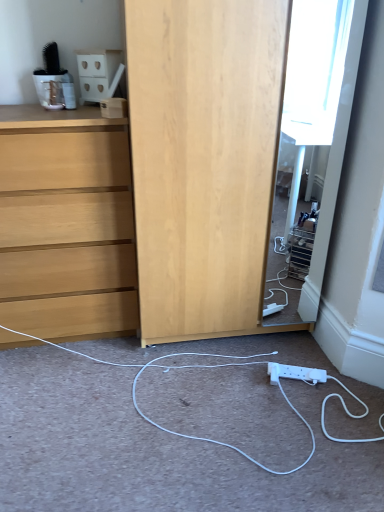
Locate an element on the screen. The height and width of the screenshot is (512, 384). white plastic power strip at lower center is located at coordinates (295, 373).

What are the coordinates of `white matte cabinet at upper left` in the screenshot? It's located at (99, 73).

I want to click on white plastic power strip at lower center, so click(295, 373).

Which object is more forward, light wood chest of drawers at left or white plastic power strip at lower center?

light wood chest of drawers at left.

From their relative heights in the image, would you say light wood chest of drawers at left is taller or shorter than white plastic power strip at lower center?

In the image, light wood chest of drawers at left appears to be taller than white plastic power strip at lower center.

From the image's perspective, is light wood chest of drawers at left located above white plastic power strip at lower center?

Yes.

Could you measure the distance between light wood chest of drawers at left and white plastic power strip at lower center?

light wood chest of drawers at left and white plastic power strip at lower center are 38.74 inches apart from each other.

From a real-world perspective, is white matte cabinet at upper left above or below white plastic power strip at lower center?

white matte cabinet at upper left is situated higher than white plastic power strip at lower center in the real world.

Which is in front, point (98, 82) or point (276, 370)?

The point (98, 82) is in front.

Consider the image. Considering the relative positions of white matte cabinet at upper left and white plastic power strip at lower center in the image provided, is white matte cabinet at upper left to the right of white plastic power strip at lower center from the viewer's perspective?

In fact, white matte cabinet at upper left is to the left of white plastic power strip at lower center.

Is white matte cabinet at upper left positioned with its back to white plastic power strip at lower center?

white matte cabinet at upper left is not turned away from white plastic power strip at lower center.

Considering the relative sizes of white plastic power strip at lower center and white matte cabinet at upper left in the image provided, is white plastic power strip at lower center wider than white matte cabinet at upper left?

Incorrect, the width of white plastic power strip at lower center does not surpass that of white matte cabinet at upper left.

How different are the orientations of white plastic power strip at lower center and white matte cabinet at upper left in degrees?

24.4 degrees.

From the image's perspective, is white plastic power strip at lower center on top of white matte cabinet at upper left?

Actually, white plastic power strip at lower center appears below white matte cabinet at upper left in the image.

Considering the positions of points (269, 362) and (86, 74), is point (269, 362) farther from camera compared to point (86, 74)?

Yes, point (269, 362) is farther from viewer.

Could you tell me if white matte cabinet at upper left is turned towards light wood chest of drawers at left?

No, white matte cabinet at upper left is not oriented towards light wood chest of drawers at left.

Based on their positions, is white matte cabinet at upper left located to the left or right of light wood chest of drawers at left?

In the image, white matte cabinet at upper left appears on the right side of light wood chest of drawers at left.

Consider the image. Can you tell me how much white matte cabinet at upper left and light wood chest of drawers at left differ in facing direction?

The angular difference between white matte cabinet at upper left and light wood chest of drawers at left is 46.9 degrees.

Between white matte cabinet at upper left and light wood chest of drawers at left, which one has smaller size?

white matte cabinet at upper left.

Could white plastic power strip at lower center be considered to be inside white plastic power strip at lower center?

That's incorrect, white plastic power strip at lower center is not inside white plastic power strip at lower center.

From the image's perspective, is white plastic power strip at lower center below white plastic power strip at lower center?

Correct, white plastic power strip at lower center appears lower than white plastic power strip at lower center in the image.

Who is bigger, white plastic power strip at lower center or white plastic power strip at lower center?

white plastic power strip at lower center.

Does white plastic power strip at lower center appear on the right side of white plastic power strip at lower center?

Indeed, white plastic power strip at lower center is positioned on the right side of white plastic power strip at lower center.

In the scene shown: Which object is further away from the camera taking this photo, light wood chest of drawers at left or white plastic power strip at lower center?

Positioned behind is light wood chest of drawers at left.

Considering the positions of point (108, 186) and point (353, 414), is point (108, 186) closer or farther from the camera than point (353, 414)?

Point (108, 186) is positioned farther from the camera compared to point (353, 414).

Find the location of a particular element. This screenshot has height=512, width=384. string located underneath the light wood chest of drawers at left (from a real-world perspective) is located at coordinates (192, 368).

Is white plastic power strip at lower center at the back of light wood chest of drawers at left?

light wood chest of drawers at left is not turned away from white plastic power strip at lower center.

Which object is more forward, white plastic power strip at lower center or white matte cabinet at upper left?

white plastic power strip at lower center is in front.

Considering the positions of objects white plastic power strip at lower center and white matte cabinet at upper left in the image provided, who is more to the right, white plastic power strip at lower center or white matte cabinet at upper left?

white plastic power strip at lower center.

Does white plastic power strip at lower center turn towards white matte cabinet at upper left?

No.

From a real-world perspective, which is physically below, white plastic power strip at lower center or white matte cabinet at upper left?

white plastic power strip at lower center.

Where is `the chest of drawers that appears above the white plastic power strip at lower center (from the image's perspective)`? the chest of drawers that appears above the white plastic power strip at lower center (from the image's perspective) is located at coordinates (66, 224).

In the image, there is a white matte cabinet at upper left. Identify the location of electric outlet below it (from a real-world perspective). (295, 373).

Based on their spatial positions, is white plastic power strip at lower center or light wood chest of drawers at left further from white plastic power strip at lower center?

light wood chest of drawers at left.

Considering their positions, is white matte cabinet at upper left positioned closer to light wood chest of drawers at left than white plastic power strip at lower center?

Based on the image, white plastic power strip at lower center appears to be nearer to light wood chest of drawers at left.

Looking at the image, which one is located further to white plastic power strip at lower center, white matte cabinet at upper left or light wood chest of drawers at left?

white matte cabinet at upper left is positioned further to the anchor white plastic power strip at lower center.

Consider the image. Which object lies further to the anchor point white matte cabinet at upper left, white plastic power strip at lower center or light wood chest of drawers at left?

Based on the image, white plastic power strip at lower center appears to be further to white matte cabinet at upper left.

When comparing their distances from white plastic power strip at lower center, does light wood chest of drawers at left or white plastic power strip at lower center seem further?

Among the two, light wood chest of drawers at left is located further to white plastic power strip at lower center.

Looking at this image, based on their spatial positions, is white plastic power strip at lower center or white matte cabinet at upper left closer to light wood chest of drawers at left?

Among the two, white matte cabinet at upper left is located nearer to light wood chest of drawers at left.

Looking at the image, which one is located further to white plastic power strip at lower center, white plastic power strip at lower center or white matte cabinet at upper left?

white matte cabinet at upper left is further to white plastic power strip at lower center.

Estimate the real-world distances between objects in this image. Which object is further from white matte cabinet at upper left, light wood chest of drawers at left or white plastic power strip at lower center?

The object further to white matte cabinet at upper left is white plastic power strip at lower center.

This screenshot has height=512, width=384. In order to click on the chest of drawers between white matte cabinet at upper left and white plastic power strip at lower center vertically in this screenshot , I will do `click(66, 224)`.

Image resolution: width=384 pixels, height=512 pixels. I want to click on string that lies between white matte cabinet at upper left and white plastic power strip at lower center from top to bottom, so tap(192, 368).

The image size is (384, 512). I want to click on the chest of drawers that lies between white matte cabinet at upper left and white plastic power strip at lower center from top to bottom, so click(x=66, y=224).

Locate an element on the screen. This screenshot has width=384, height=512. string between light wood chest of drawers at left and white plastic power strip at lower center is located at coordinates (192, 368).